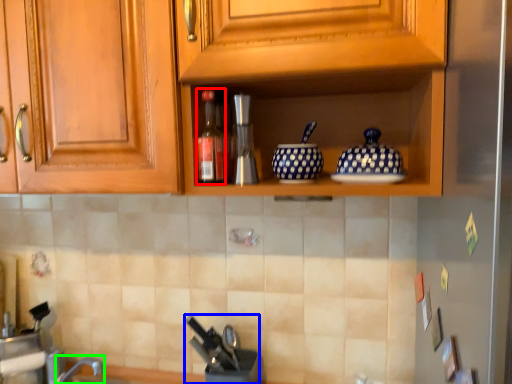
Question: Which object is the closest to the bottle (highlighted by a red box)? Choose among these: appliance (highlighted by a blue box) or faucet (highlighted by a green box).

Choices:
 (A) appliance
 (B) faucet

Answer: (A)